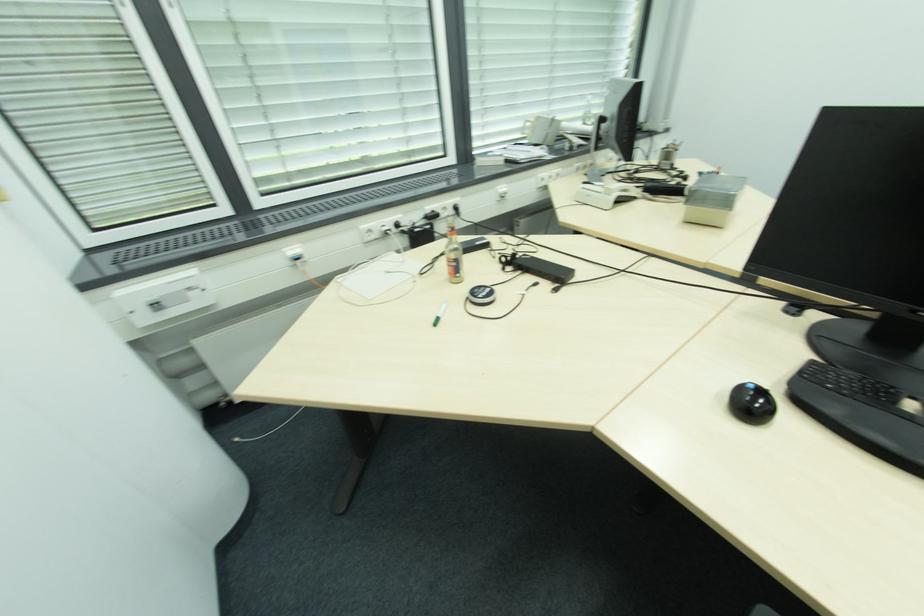
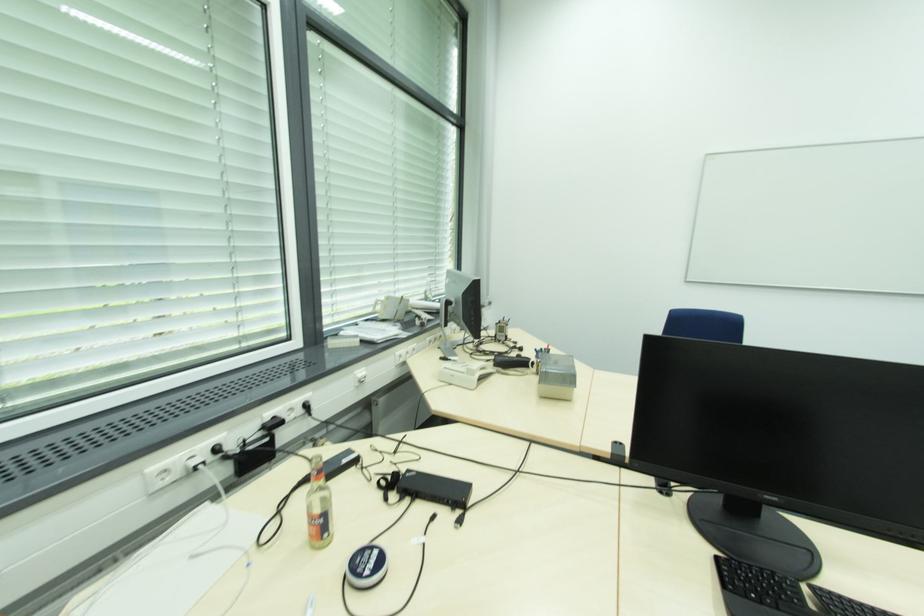
The point at (628,191) is marked in the first image. Where is the corresponding point in the second image?

(487, 369)